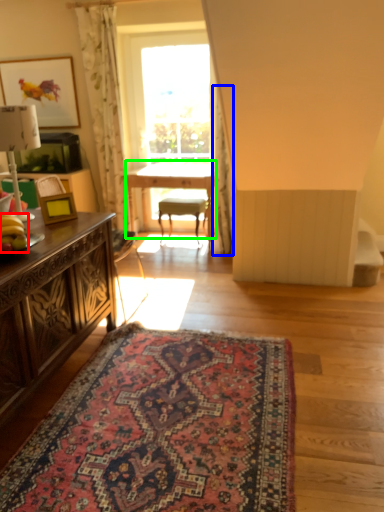
Question: Which is nearer to the banana (highlighted by a red box)? curtain (highlighted by a blue box) or table (highlighted by a green box).

Choices:
 (A) curtain
 (B) table

Answer: (A)